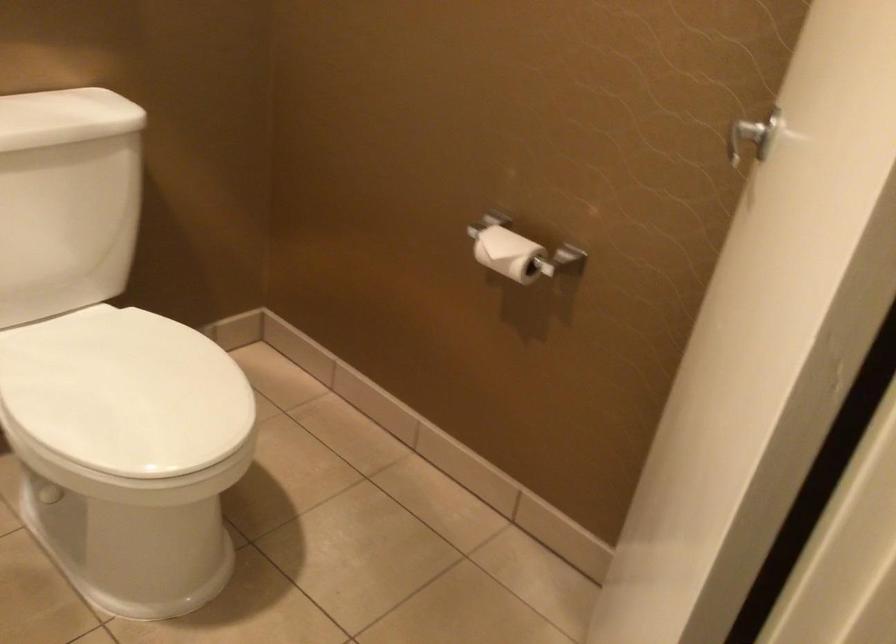
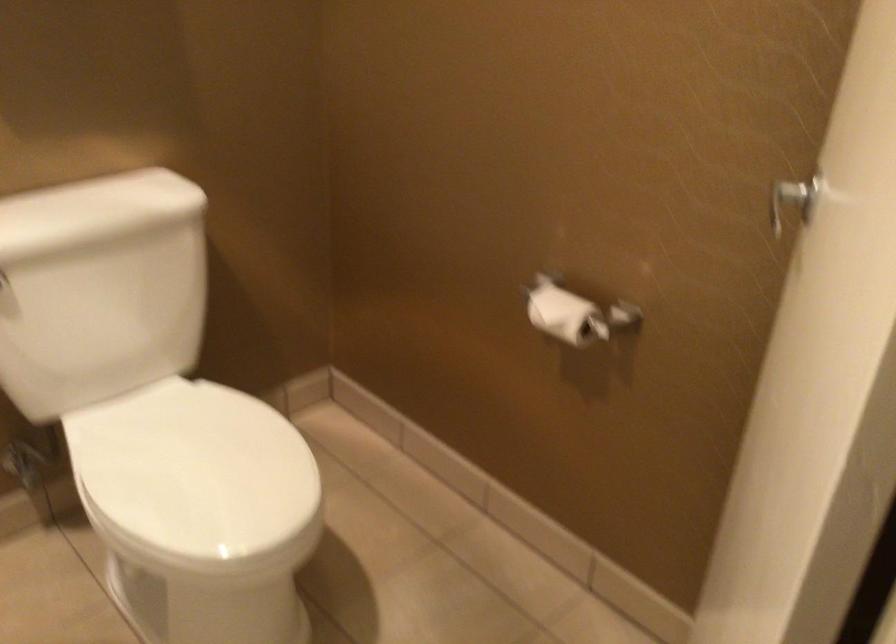
Question: Which direction would the cameraman need to move to produce the second image? Reply with the corresponding letter.

Choices:
 (A) Left
 (B) Right
 (C) Forward
 (D) Backward

Answer: (B)